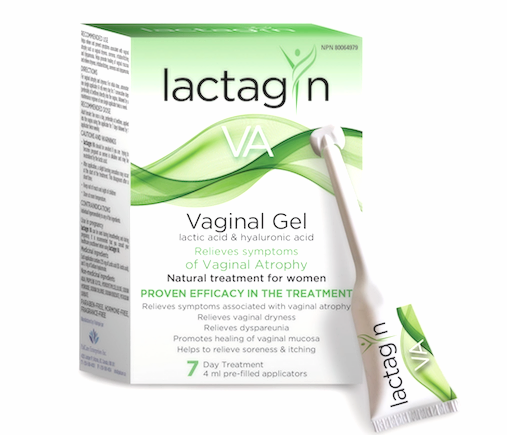
Identify the location of box. The height and width of the screenshot is (435, 507). (277, 201).